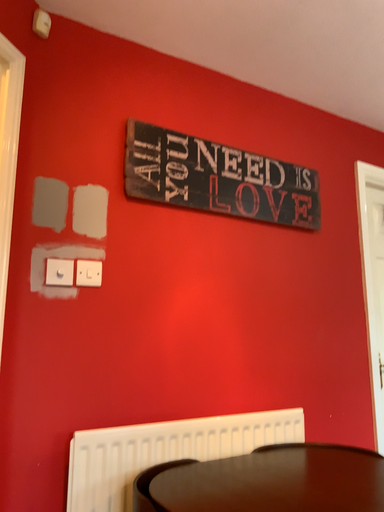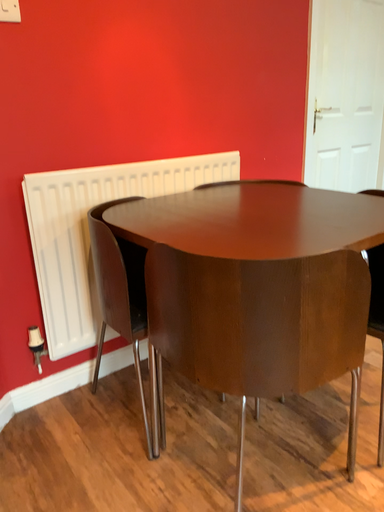
Question: Which way did the camera rotate in the video?

Choices:
 (A) rotated left
 (B) rotated right

Answer: (B)